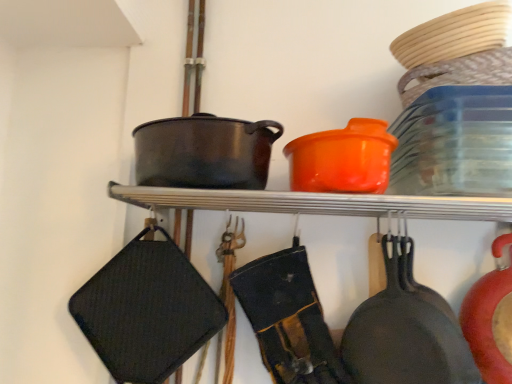
Question: Looking at their shapes, would you say orange matte pot at upper center is wider or thinner than orange plastic pot at upper center?

Choices:
 (A) wide
 (B) thin

Answer: (B)

Question: Looking at the image, does orange matte pot at upper center seem bigger or smaller compared to orange plastic pot at upper center?

Choices:
 (A) big
 (B) small

Answer: (A)

Question: Which of these objects is positioned closest to the orange plastic pot at upper center?

Choices:
 (A) matte black wok at center
 (B) matte black frying pan at lower right
 (C) orange matte pot at upper center

Answer: (C)

Question: Based on their relative distances, which object is farther from the orange plastic pot at upper center?

Choices:
 (A) orange matte pot at upper center
 (B) matte black wok at center
 (C) matte black frying pan at lower right

Answer: (C)